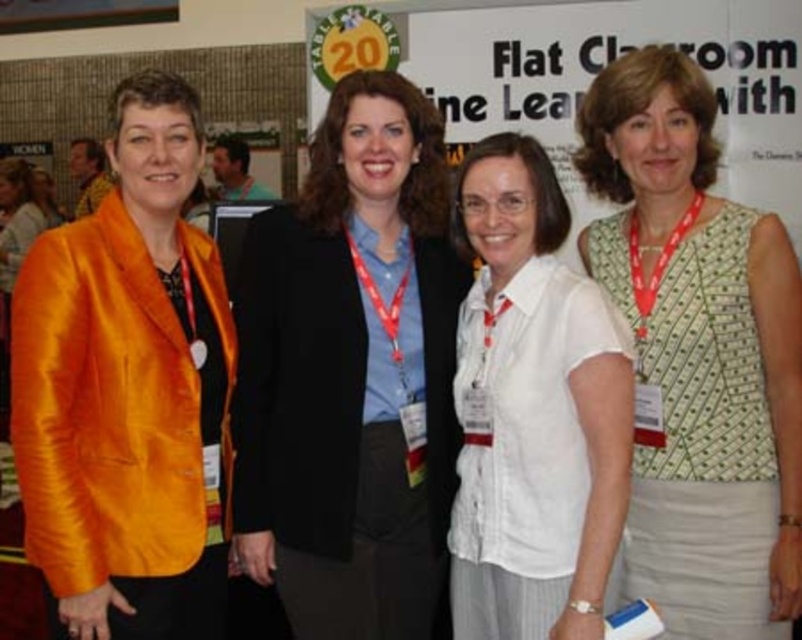
Measure the distance between green dotted vest at center and camera.

The distance of green dotted vest at center from camera is 5.84 feet.

This screenshot has height=640, width=802. Find the location of `green dotted vest at center`. green dotted vest at center is located at coordinates (699, 353).

Who is shorter, satin orange blazer at left or white cotton shirt at center?

With less height is white cotton shirt at center.

Which is in front, point (84, 564) or point (529, 529)?

Point (84, 564) is more forward.

Is point (189, 536) less distant than point (474, 172)?

That is True.

I want to click on satin orange blazer at left, so click(x=128, y=390).

Which is in front, point (209, 317) or point (703, 346)?

Positioned in front is point (703, 346).

Who is positioned more to the right, satin orange blazer at left or green dotted vest at center?

green dotted vest at center

This screenshot has height=640, width=802. I want to click on satin orange blazer at left, so click(x=128, y=390).